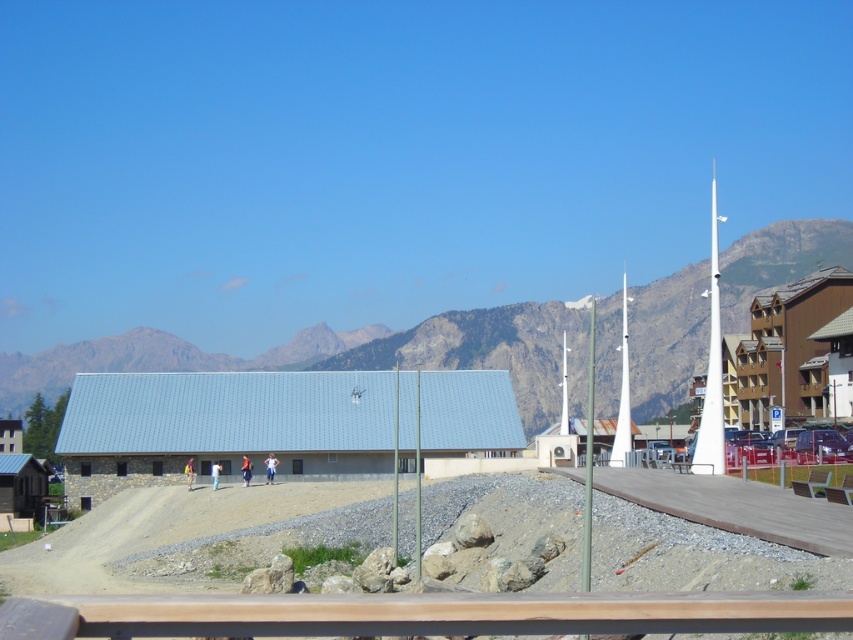
Is brown wooden rail at lower center behind white glossy flag pole at center?

No, brown wooden rail at lower center is closer to the viewer.

Does brown wooden rail at lower center appear on the right side of white glossy flag pole at center?

No, brown wooden rail at lower center is not to the right of white glossy flag pole at center.

Between point (25, 634) and point (566, 372), which one is positioned behind?

Point (566, 372)

At what (x,y) coordinates should I click in order to perform the action: click on brown wooden rail at lower center. Please return your answer as a coordinate pair (x, y). The image size is (853, 640). Looking at the image, I should click on (421, 614).

Does gray metallic building at center have a lesser height compared to white glossy flag pole at center?

Incorrect, gray metallic building at center's height does not fall short of white glossy flag pole at center's.

Who is more distant from viewer, (325, 333) or (566, 385)?

The point (325, 333) is behind.

Locate an element on the screen. Image resolution: width=853 pixels, height=640 pixels. gray metallic building at center is located at coordinates (344, 355).

Does brown wooden rail at lower center have a smaller size compared to white glossy flag pole at right?

Yes, brown wooden rail at lower center is smaller than white glossy flag pole at right.

Is brown wooden rail at lower center below white glossy flag pole at right?

Yes, brown wooden rail at lower center is below white glossy flag pole at right.

Who is more forward, (846, 612) or (714, 467)?

Point (846, 612)

At what (x,y) coordinates should I click in order to perform the action: click on brown wooden rail at lower center. Please return your answer as a coordinate pair (x, y). This screenshot has width=853, height=640. Looking at the image, I should click on (421, 614).